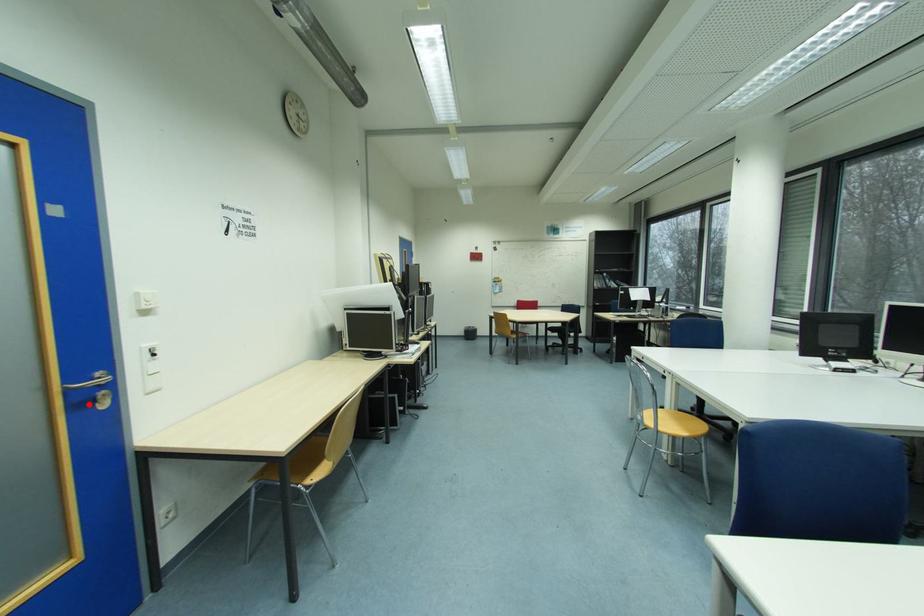
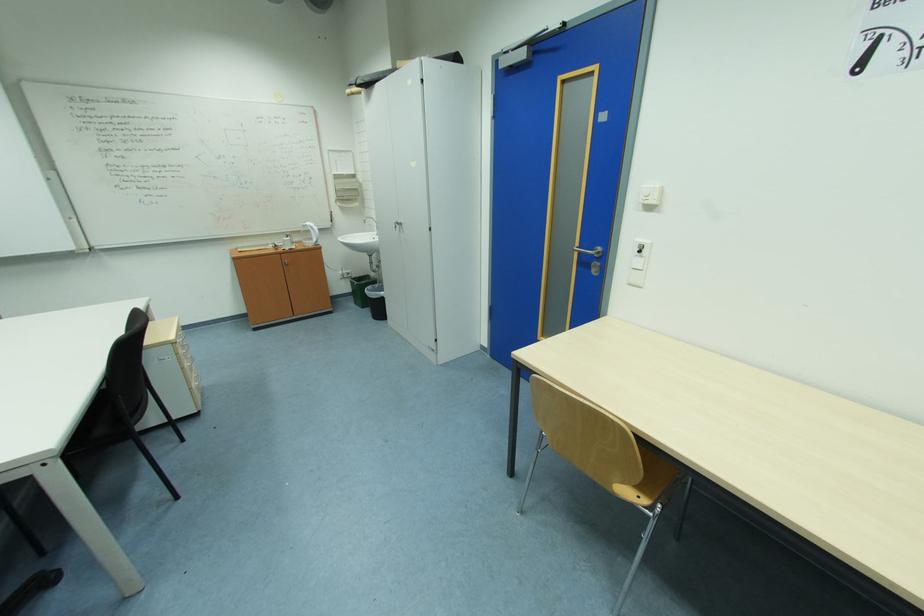
The point at the highlighted location is marked in the first image. Where is the corresponding point in the second image?

(590, 264)